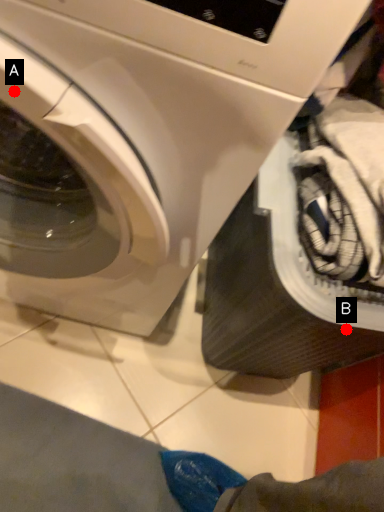
Question: Two points are circled on the image, labeled by A and B beside each circle. Which point is closer to the camera?

Choices:
 (A) A is closer
 (B) B is closer

Answer: (A)